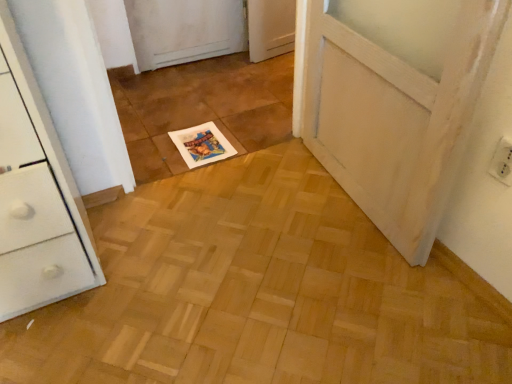
Measure the distance between white paper magazine at center and camera.

white paper magazine at center and camera are 5.48 feet apart.

The height and width of the screenshot is (384, 512). What do you see at coordinates (202, 145) in the screenshot? I see `white paper magazine at center` at bounding box center [202, 145].

Where is `white paper magazine at center`? The width and height of the screenshot is (512, 384). white paper magazine at center is located at coordinates (202, 145).

I want to click on white plastic electric outlet at upper right, so click(x=502, y=162).

What do you see at coordinates (502, 162) in the screenshot? This screenshot has height=384, width=512. I see `white plastic electric outlet at upper right` at bounding box center [502, 162].

I want to click on white paper magazine at center, so tap(202, 145).

From the picture: Is white plastic electric outlet at upper right to the left of white paper magazine at center from the viewer's perspective?

No.

Is the position of white plastic electric outlet at upper right less distant than that of white paper magazine at center?

That is True.

Is point (500, 160) less distant than point (207, 122)?

Yes, it is.

From the image's perspective, is white plastic electric outlet at upper right below white paper magazine at center?

Correct, white plastic electric outlet at upper right appears lower than white paper magazine at center in the image.

From a real-world perspective, which object stands above the other?

white plastic electric outlet at upper right, from a real-world perspective.

Considering the relative sizes of white plastic electric outlet at upper right and white paper magazine at center in the image provided, is white plastic electric outlet at upper right wider than white paper magazine at center?

In fact, white plastic electric outlet at upper right might be narrower than white paper magazine at center.

In the scene shown: Does white plastic electric outlet at upper right have a lesser height compared to white paper magazine at center?

No, white plastic electric outlet at upper right is not shorter than white paper magazine at center.

Looking at the image, does white plastic electric outlet at upper right seem bigger or smaller compared to white paper magazine at center?

In the image, white plastic electric outlet at upper right appears to be smaller than white paper magazine at center.

Is white paper magazine at center completely or partially inside white plastic electric outlet at upper right?

That's incorrect, white paper magazine at center is not inside white plastic electric outlet at upper right.

Is white plastic electric outlet at upper right far from white paper magazine at center?

white plastic electric outlet at upper right is far away from white paper magazine at center.

Is white plastic electric outlet at upper right aimed at white paper magazine at center?

No.

How different are the orientations of white plastic electric outlet at upper right and white paper magazine at center in degrees?

The angle between the facing direction of white plastic electric outlet at upper right and the facing direction of white paper magazine at center is 86.4 degrees.

The width and height of the screenshot is (512, 384). I want to click on magazine on the left of white plastic electric outlet at upper right, so click(x=202, y=145).

Which object is positioned more to the left, white paper magazine at center or white plastic electric outlet at upper right?

From the viewer's perspective, white paper magazine at center appears more on the left side.

Does white paper magazine at center come in front of white plastic electric outlet at upper right?

That is False.

Is point (221, 134) closer or farther from the camera than point (500, 177)?

Point (221, 134) is farther from the camera than point (500, 177).

From the image's perspective, would you say white paper magazine at center is shown under white plastic electric outlet at upper right?

No.

Based on the photo, from a real-world perspective, is white paper magazine at center on top of white plastic electric outlet at upper right?

Incorrect, from a real-world perspective, white paper magazine at center is lower than white plastic electric outlet at upper right.

Between white paper magazine at center and white plastic electric outlet at upper right, which one has larger width?

white paper magazine at center.

Does white paper magazine at center have a greater height compared to white plastic electric outlet at upper right?

In fact, white paper magazine at center may be shorter than white plastic electric outlet at upper right.

Considering the relative sizes of white paper magazine at center and white plastic electric outlet at upper right in the image provided, is white paper magazine at center bigger than white plastic electric outlet at upper right?

Indeed, white paper magazine at center has a larger size compared to white plastic electric outlet at upper right.

Can we say white paper magazine at center lies outside white plastic electric outlet at upper right?

Indeed, white paper magazine at center is completely outside white plastic electric outlet at upper right.

Is white paper magazine at center touching white plastic electric outlet at upper right?

white paper magazine at center and white plastic electric outlet at upper right are clearly separated.

Is white paper magazine at center facing away from white plastic electric outlet at upper right?

No.

How many degrees apart are the facing directions of white paper magazine at center and white plastic electric outlet at upper right?

The angle between the facing direction of white paper magazine at center and the facing direction of white plastic electric outlet at upper right is 86.4 degrees.

Measure the distance from white paper magazine at center to white plastic electric outlet at upper right.

white paper magazine at center is 1.08 meters away from white plastic electric outlet at upper right.

Find the location of a particular element. The width and height of the screenshot is (512, 384). electric outlet below the white paper magazine at center (from the image's perspective) is located at coordinates (502, 162).

Locate an element on the screen. This screenshot has height=384, width=512. electric outlet that appears below the white paper magazine at center (from the image's perspective) is located at coordinates (502, 162).

The width and height of the screenshot is (512, 384). What are the coordinates of `magazine located on the left of white plastic electric outlet at upper right` in the screenshot? It's located at (202, 145).